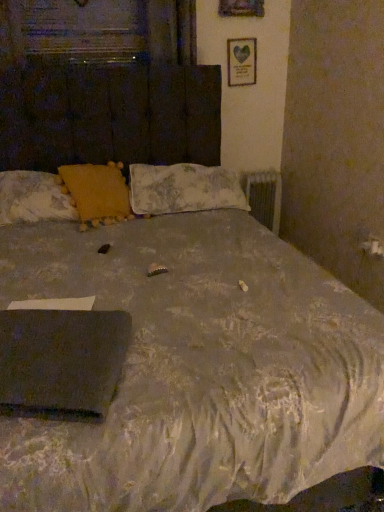
Question: Considering the relative positions of black matte laptop at lower left and metallic silver radiator at right in the image provided, is black matte laptop at lower left in front of metallic silver radiator at right?

Choices:
 (A) yes
 (B) no

Answer: (A)

Question: From a real-world perspective, does black matte laptop at lower left stand above metallic silver radiator at right?

Choices:
 (A) yes
 (B) no

Answer: (A)

Question: Is black matte laptop at lower left far from metallic silver radiator at right?

Choices:
 (A) no
 (B) yes

Answer: (B)

Question: Would you say black matte laptop at lower left is outside metallic silver radiator at right?

Choices:
 (A) yes
 (B) no

Answer: (A)

Question: Are black matte laptop at lower left and metallic silver radiator at right beside each other?

Choices:
 (A) yes
 (B) no

Answer: (B)

Question: In the image, is fluffy fabric pillow at center, the 3th pillow in the left-to-right sequence, positioned in front of or behind yellow fabric pillow at upper left, positioned as the first pillow in left-to-right order?

Choices:
 (A) behind
 (B) front

Answer: (A)

Question: Which is correct: fluffy fabric pillow at center, the 3th pillow in the left-to-right sequence, is inside yellow fabric pillow at upper left, positioned as the first pillow in left-to-right order, or outside of it?

Choices:
 (A) inside
 (B) outside

Answer: (B)

Question: Considering the positions of point (198, 202) and point (13, 207), is point (198, 202) closer or farther from the camera than point (13, 207)?

Choices:
 (A) farther
 (B) closer

Answer: (A)

Question: From a real-world perspective, relative to yellow fabric pillow at upper left, the 3th pillow in the right-to-left sequence, is fluffy fabric pillow at center, the first pillow viewed from the right, vertically above or below?

Choices:
 (A) above
 (B) below

Answer: (B)

Question: Considering the positions of black matte laptop at lower left and yellow fabric pillow at upper center, the second pillow when ordered from left to right, in the image, is black matte laptop at lower left bigger or smaller than yellow fabric pillow at upper center, the second pillow when ordered from left to right,?

Choices:
 (A) big
 (B) small

Answer: (B)

Question: Is black matte laptop at lower left taller or shorter than yellow fabric pillow at upper center, the second pillow positioned from the right?

Choices:
 (A) tall
 (B) short

Answer: (B)

Question: From the image's perspective, is black matte laptop at lower left located above or below yellow fabric pillow at upper center, the second pillow when ordered from left to right?

Choices:
 (A) below
 (B) above

Answer: (A)

Question: From a real-world perspective, is black matte laptop at lower left above or below yellow fabric pillow at upper center, the second pillow positioned from the right?

Choices:
 (A) above
 (B) below

Answer: (B)

Question: Visually, is metallic silver radiator at right positioned to the left or to the right of yellow fabric pillow at upper left, positioned as the first pillow in left-to-right order?

Choices:
 (A) right
 (B) left

Answer: (A)

Question: From the image's perspective, is metallic silver radiator at right positioned above or below yellow fabric pillow at upper left, the 3th pillow in the right-to-left sequence?

Choices:
 (A) below
 (B) above

Answer: (B)